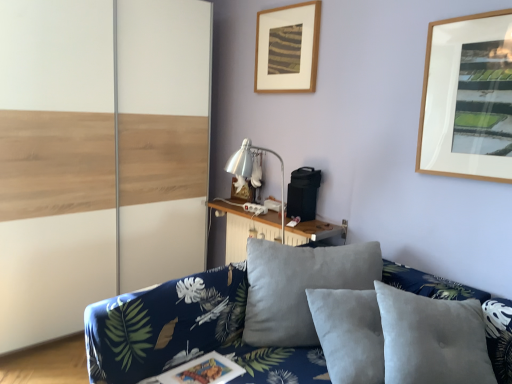
Question: Is white wood barn door at left at the back of wooden picture frame at upper center, acting as the first picture frame starting from the back?

Choices:
 (A) no
 (B) yes

Answer: (A)

Question: Is wooden picture frame at upper center, arranged as the second picture frame when viewed from the front, further to camera compared to white wood barn door at left?

Choices:
 (A) yes
 (B) no

Answer: (A)

Question: Is wooden picture frame at upper center, acting as the first picture frame starting from the back, oriented towards white wood barn door at left?

Choices:
 (A) yes
 (B) no

Answer: (B)

Question: Considering the relative sizes of wooden picture frame at upper center, arranged as the second picture frame when viewed from the front, and white wood barn door at left in the image provided, is wooden picture frame at upper center, arranged as the second picture frame when viewed from the front, bigger than white wood barn door at left?

Choices:
 (A) yes
 (B) no

Answer: (B)

Question: From a real-world perspective, is wooden picture frame at upper center, which is the second picture frame in right-to-left order, physically above white wood barn door at left?

Choices:
 (A) yes
 (B) no

Answer: (B)

Question: Looking at their shapes, would you say white wood barn door at left is wider or thinner than wooden picture frame at upper center, acting as the first picture frame starting from the back?

Choices:
 (A) thin
 (B) wide

Answer: (B)

Question: Is white wood barn door at left situated inside wooden picture frame at upper center, which ranks as the 1th picture frame in bottom-to-top order, or outside?

Choices:
 (A) outside
 (B) inside

Answer: (A)

Question: From a real-world perspective, is white wood barn door at left above or below wooden picture frame at upper center, acting as the first picture frame starting from the back?

Choices:
 (A) below
 (B) above

Answer: (B)

Question: Considering their positions, is white wood barn door at left located in front of or behind wooden picture frame at upper center, the 1th picture frame viewed from the left?

Choices:
 (A) behind
 (B) front

Answer: (B)

Question: In terms of height, does white wood barn door at left look taller or shorter compared to blue floral fabric couch at lower center?

Choices:
 (A) tall
 (B) short

Answer: (A)

Question: Which is correct: white wood barn door at left is inside blue floral fabric couch at lower center, or outside of it?

Choices:
 (A) inside
 (B) outside

Answer: (B)

Question: From the image's perspective, is white wood barn door at left positioned above or below blue floral fabric couch at lower center?

Choices:
 (A) below
 (B) above

Answer: (B)

Question: In the image, is white wood barn door at left positioned in front of or behind blue floral fabric couch at lower center?

Choices:
 (A) front
 (B) behind

Answer: (B)

Question: In terms of size, does suede gray pillow at center appear bigger or smaller than blue floral fabric couch at lower center?

Choices:
 (A) small
 (B) big

Answer: (A)

Question: From a real-world perspective, is suede gray pillow at center above or below blue floral fabric couch at lower center?

Choices:
 (A) below
 (B) above

Answer: (B)